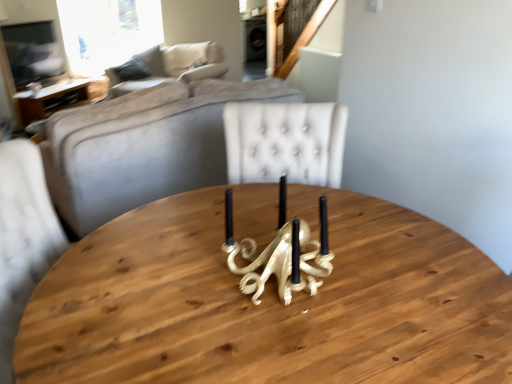
Question: Visually, is beige fabric pillow at upper center positioned to the left or to the right of gold metallic octopus at center?

Choices:
 (A) left
 (B) right

Answer: (A)

Question: Does point (178, 72) appear closer or farther from the camera than point (253, 246)?

Choices:
 (A) closer
 (B) farther

Answer: (B)

Question: Considering the real-world distances, which object is closest to the gold metallic octopus at center?

Choices:
 (A) beige fabric couch at upper left
 (B) beige fabric pillow at upper center
 (C) wooden table at left

Answer: (C)

Question: Which of these objects is positioned closest to the gold metallic octopus at center?

Choices:
 (A) wooden table at left
 (B) beige fabric couch at upper left
 (C) beige fabric pillow at upper center

Answer: (A)